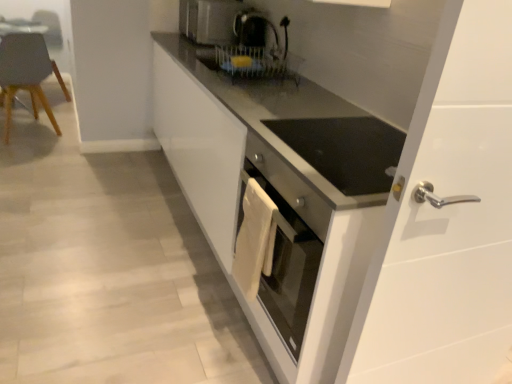
The height and width of the screenshot is (384, 512). Identify the location of vacant space that is in between matte gray chair at left and white glossy cabinet at center. (121, 208).